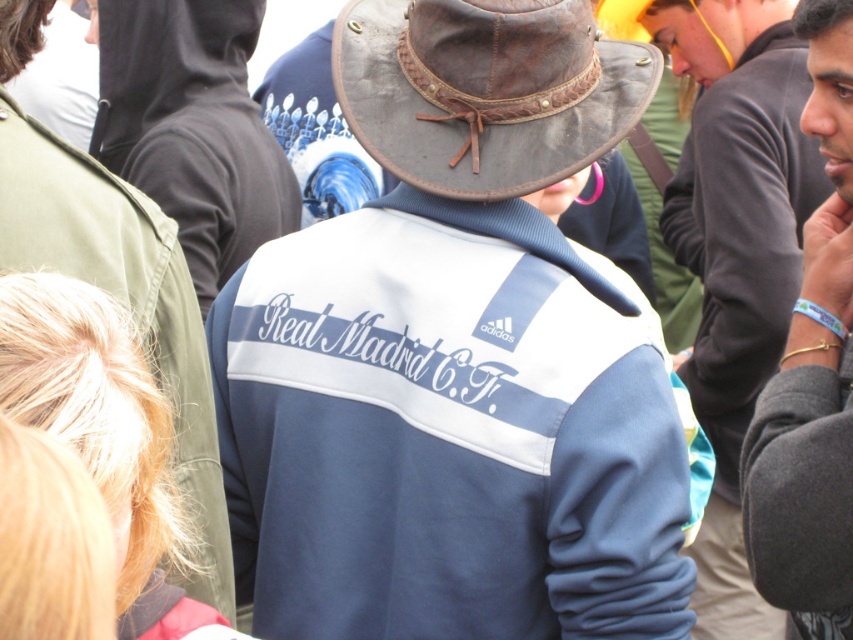
Question: Which point appears closest to the camera in this image?

Choices:
 (A) (543, 257)
 (B) (689, 205)
 (C) (103, 228)

Answer: (C)

Question: Which is farther from the dark gray sweatshirt at right?

Choices:
 (A) navy blue fleece jacket at center
 (B) brown leather fedora at center
 (C) blue fleece jacket at center

Answer: (C)

Question: Which of the following is the farthest from the observer?

Choices:
 (A) (804, 134)
 (B) (798, 596)

Answer: (A)

Question: Does navy blue fleece jacket at center have a lesser width compared to dark gray sweatshirt at right?

Choices:
 (A) no
 (B) yes

Answer: (A)

Question: Does brown leather fedora at center appear over gray fleece jacket at center?

Choices:
 (A) no
 (B) yes

Answer: (B)

Question: Can you confirm if gray fleece jacket at center is thinner than dark gray sweatshirt at right?

Choices:
 (A) no
 (B) yes

Answer: (B)